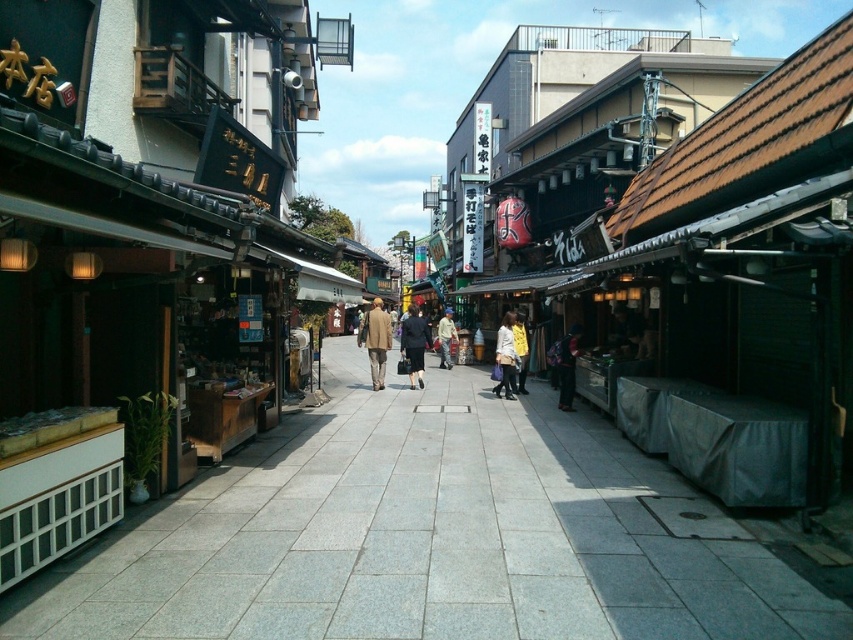
Question: Which point is farther to the camera?

Choices:
 (A) (403, 339)
 (B) (380, 344)

Answer: (A)

Question: Can you confirm if light brown fabric coat at center is positioned above yellow fabric bag at center?

Choices:
 (A) yes
 (B) no

Answer: (A)

Question: Which object appears closest to the camera in this image?

Choices:
 (A) gray stone pavement at center
 (B) light brown fabric coat at center
 (C) yellow matte jacket at center
 (D) light beige coat at center

Answer: (A)

Question: Is dark blue fabric jacket at center thinner than yellow matte jacket at center?

Choices:
 (A) yes
 (B) no

Answer: (B)

Question: Is gray stone pavement at center positioned at the back of light brown fabric coat at center?

Choices:
 (A) yes
 (B) no

Answer: (B)

Question: Based on their relative distances, which object is nearer to the matte black coat at center?

Choices:
 (A) yellow matte jacket at center
 (B) light brown fabric coat at center
 (C) yellow fabric bag at center
 (D) dark blue fabric jacket at center

Answer: (B)